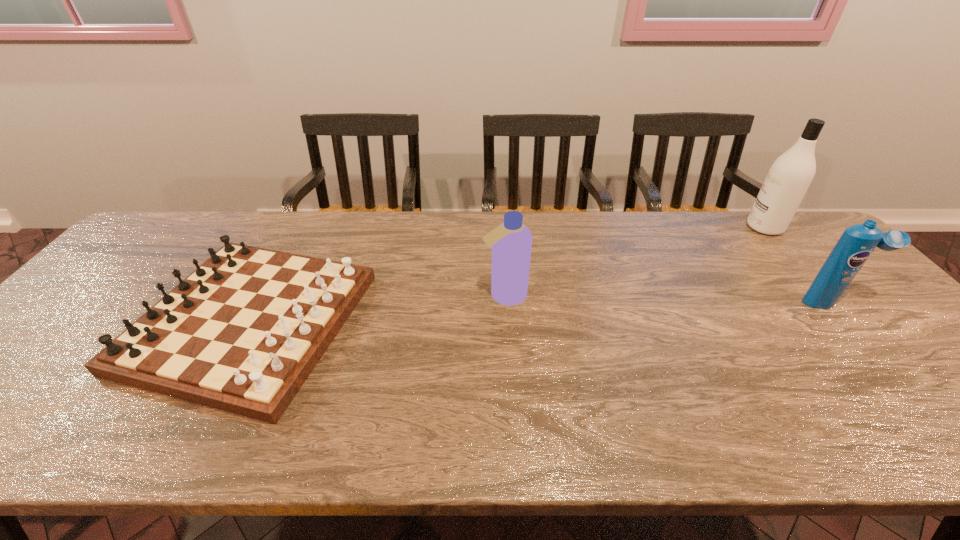
Find the location of a particular element. This screenshot has width=960, height=540. free space between the third object from right to left and the leftmost object is located at coordinates (377, 308).

Image resolution: width=960 pixels, height=540 pixels. Identify the location of vacant space that is in between the third object from right to left and the leftmost object. (377, 308).

Where is `free space between the third object from right to left and the leftmost object`? This screenshot has width=960, height=540. free space between the third object from right to left and the leftmost object is located at coordinates (377, 308).

Point out which object is positioned as the third nearest to the shortest object. Please provide its 2D coordinates. Your answer should be formatted as a tuple, i.e. [(x, y)], where the tuple contains the x and y coordinates of a point satisfying the conditions above.

[(788, 179)]

You are a GUI agent. You are given a task and a screenshot of the screen. Output one action in this format:
    pyautogui.click(x=<x>, y=<y>)
    Task: Click on the second closest object to the leftmost shampoo
    The width and height of the screenshot is (960, 540).
    Given the screenshot: What is the action you would take?
    pyautogui.click(x=856, y=244)

This screenshot has height=540, width=960. I want to click on shampoo that is the closest to the chessboard, so click(511, 241).

The height and width of the screenshot is (540, 960). What are the coordinates of `the second closest shampoo to the tallest object` in the screenshot? It's located at (511, 241).

At what (x,y) coordinates should I click in order to perform the action: click on vacant space that satisfies the following two spatial constraints: 1. on the front-facing side of the farthest shampoo; 2. on the front side of the third object from right to left. Please return your answer as a coordinate pair (x, y). Image resolution: width=960 pixels, height=540 pixels. Looking at the image, I should click on (823, 295).

This screenshot has width=960, height=540. Find the location of `vacant space that satisfies the following two spatial constraints: 1. on the back side of the third object from right to left; 2. on the left side of the chessboard`. vacant space that satisfies the following two spatial constraints: 1. on the back side of the third object from right to left; 2. on the left side of the chessboard is located at coordinates (264, 295).